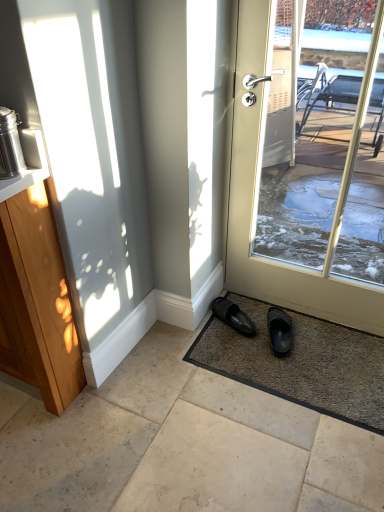
The height and width of the screenshot is (512, 384). In order to click on empty space that is to the right of black rubber slipper at lower center, the 2th footwear when ordered from right to left in this screenshot , I will do `click(263, 316)`.